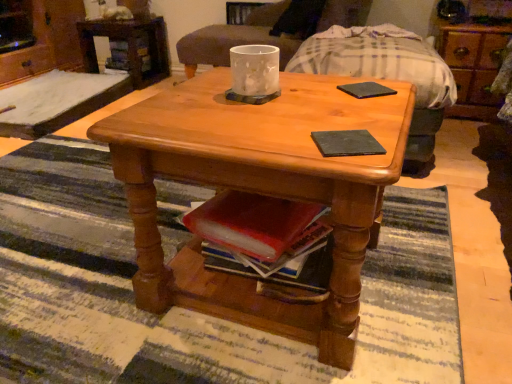
This screenshot has width=512, height=384. Identify the location of free space to the back side of black matte pad at center, acting as the second pad starting from the top. (332, 114).